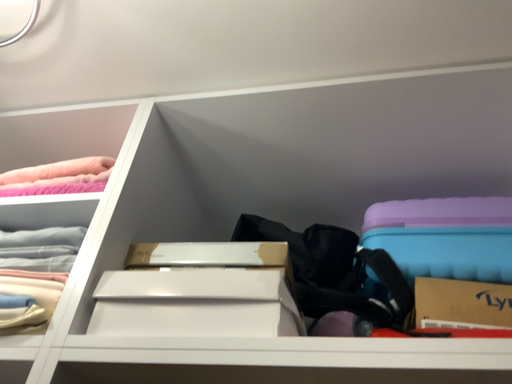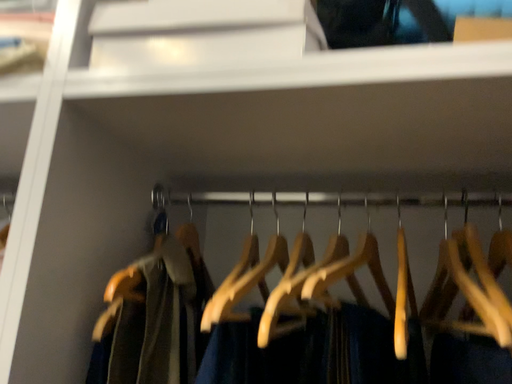
Question: Which way did the camera rotate in the video?

Choices:
 (A) rotated downward
 (B) rotated upward

Answer: (A)